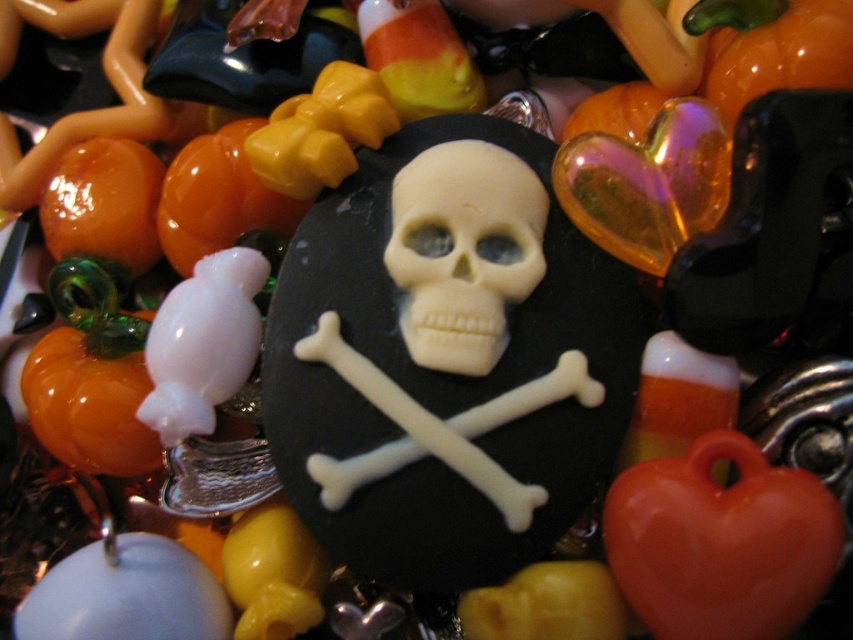
Question: Where is glossy plastic heart at lower right located in relation to white matte skull at center in the image?

Choices:
 (A) below
 (B) above

Answer: (A)

Question: Which point is farther to the camera?

Choices:
 (A) glossy plastic heart at lower right
 (B) white matte skull at center

Answer: (B)

Question: From the image, what is the correct spatial relationship of glossy plastic heart at lower right in relation to white matte skull at center?

Choices:
 (A) below
 (B) above

Answer: (A)

Question: Does glossy plastic heart at lower right appear over white matte skull at center?

Choices:
 (A) no
 (B) yes

Answer: (A)

Question: Which object is closer to the camera taking this photo?

Choices:
 (A) glossy plastic heart at lower right
 (B) white matte skull at center

Answer: (A)